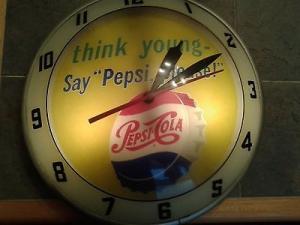
Identify the location of table. The image size is (300, 225). (274, 215).